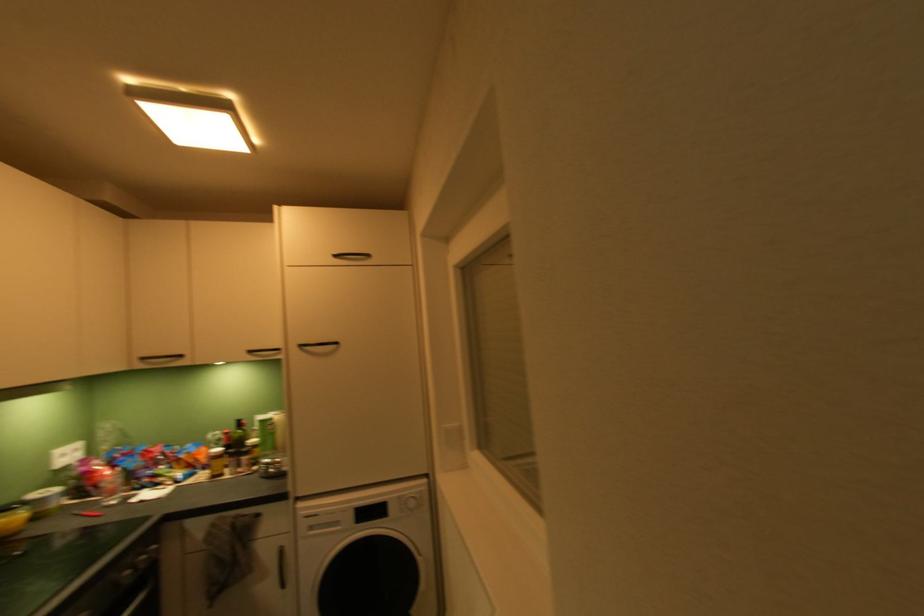
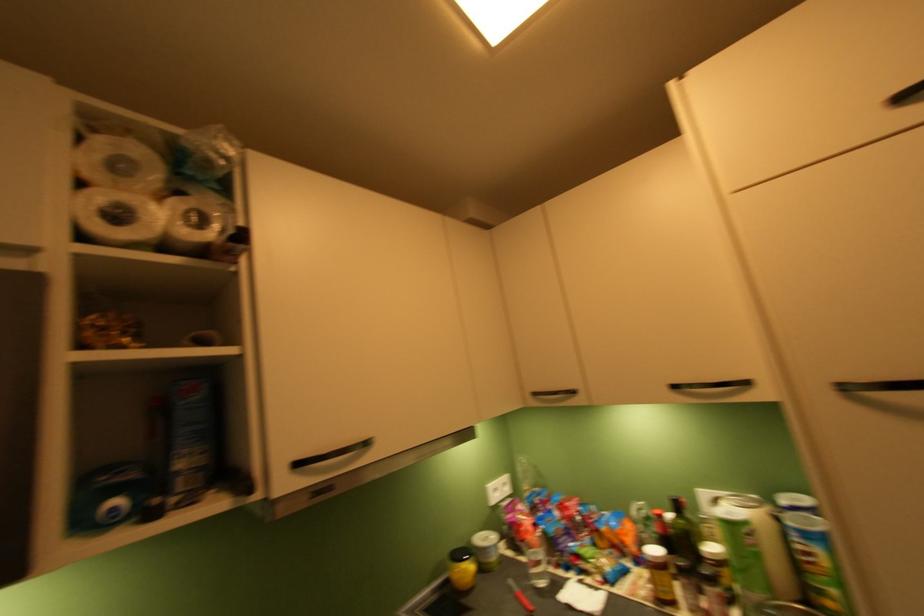
Question: Based on the continuous images, in which direction is the camera rotating? Reply with the corresponding letter.

Choices:
 (A) Left
 (B) Right
 (C) Up
 (D) Down

Answer: (A)